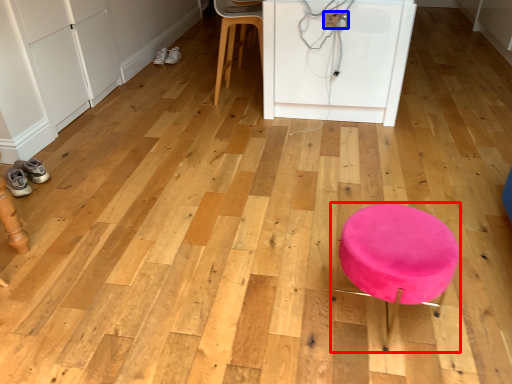
Question: Among these objects, which one is nearest to the camera, furniture (highlighted by a red box) or electric outlet (highlighted by a blue box)?

Choices:
 (A) furniture
 (B) electric outlet

Answer: (A)